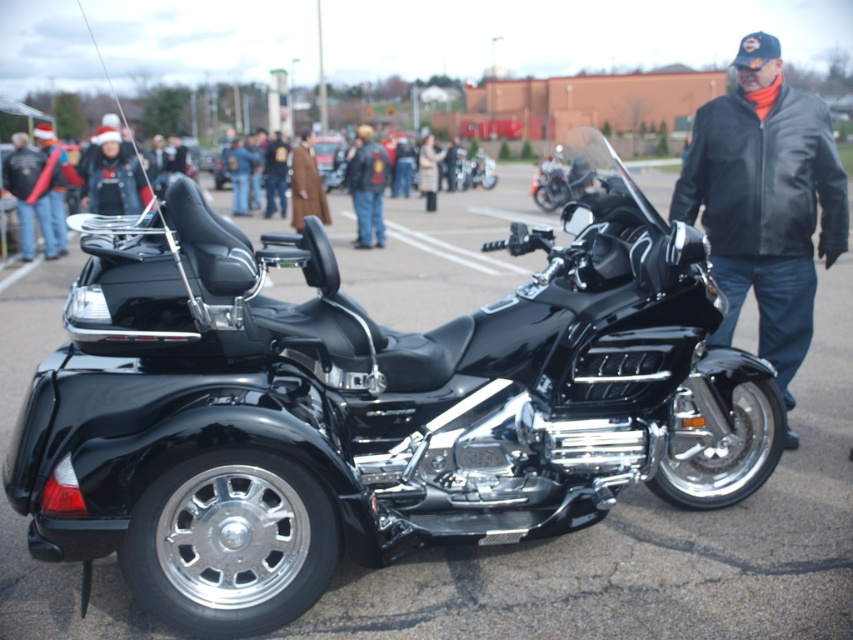
Question: Among these objects, which one is farthest from the camera?

Choices:
 (A) brown wool coat at center
 (B) black leather jacket at center

Answer: (A)

Question: Is black polished trike at center in front of leather jacket at center?

Choices:
 (A) no
 (B) yes

Answer: (B)

Question: Does brown wool coat at center have a greater width compared to black metallic motorcycle at center?

Choices:
 (A) yes
 (B) no

Answer: (A)

Question: Is black metallic motorcycle at center in front of light beige coat at center?

Choices:
 (A) yes
 (B) no

Answer: (B)

Question: Which of the following is the closest to the observer?

Choices:
 (A) black leather jacket at center
 (B) black metallic motorcycle at center

Answer: (A)

Question: Which point is closer to the camera?

Choices:
 (A) (281, 474)
 (B) (376, 195)
 (C) (308, 212)
 (D) (767, 164)

Answer: (A)